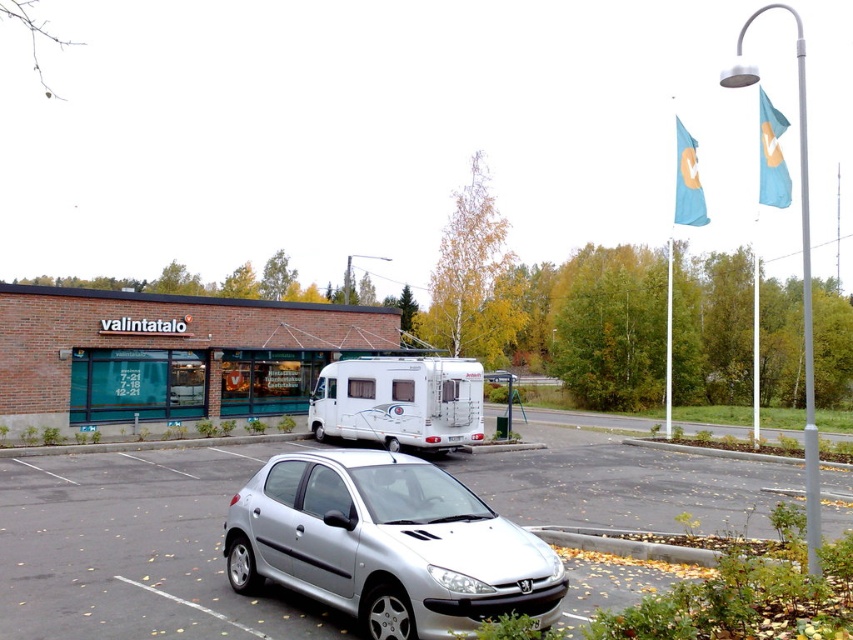
Question: Which object appears closest to the camera in this image?

Choices:
 (A) silver metallic car at center
 (B) silver metallic car at lower center

Answer: (B)

Question: Is silver metallic car at center further to camera compared to silver metallic car at lower center?

Choices:
 (A) no
 (B) yes

Answer: (B)

Question: Is silver metallic car at lower center bigger than white glossy camper at center?

Choices:
 (A) no
 (B) yes

Answer: (B)

Question: Which of the following is the closest to the observer?

Choices:
 (A) silver metallic car at center
 (B) silver metallic car at lower center

Answer: (B)

Question: Does silver metallic car at lower center lie behind white glossy camper at center?

Choices:
 (A) yes
 (B) no

Answer: (B)

Question: Estimate the real-world distances between objects in this image. Which object is closer to the silver metallic car at center?

Choices:
 (A) white glossy camper at center
 (B) silver metallic car at lower center

Answer: (B)